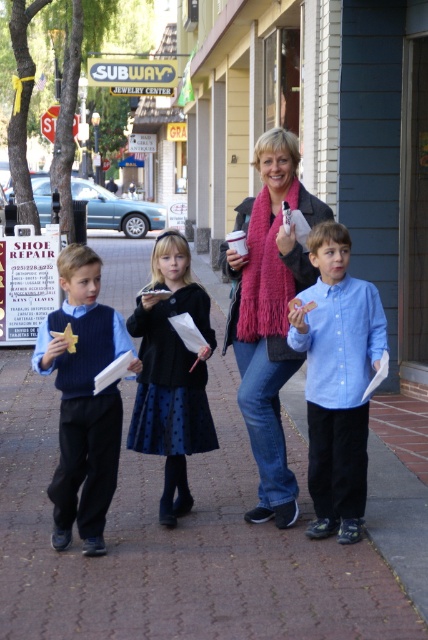
Who is shorter, blue button-down shirt at center or black wool sweater at center?

With less height is black wool sweater at center.

Which is more to the left, blue button-down shirt at center or black wool sweater at center?

Positioned to the left is black wool sweater at center.

Which is behind, point (368, 376) or point (174, 260)?

Positioned behind is point (174, 260).

Locate an element on the screen. This screenshot has width=428, height=640. blue button-down shirt at center is located at coordinates (336, 380).

At what (x,y) coordinates should I click in order to perform the action: click on brown brick pavement at center. Please return your answer as a coordinate pair (x, y). The width and height of the screenshot is (428, 640). Looking at the image, I should click on coord(177,540).

Is point (223, 492) more distant than point (276, 522)?

That is True.

Who is more distant from viewer, (146, 493) or (241, 225)?

Point (146, 493)

Where is `brown brick pavement at center`? Image resolution: width=428 pixels, height=640 pixels. brown brick pavement at center is located at coordinates (177, 540).

Measure the distance from brown brick pavement at center to black wool sweater at center.

The distance of brown brick pavement at center from black wool sweater at center is 4.29 feet.

Does point (27, 374) lie in front of point (171, 484)?

No, (27, 374) is further to viewer.

Is point (166, 538) positioned in front of point (172, 326)?

Yes, point (166, 538) is in front of point (172, 326).

I want to click on brown brick pavement at center, so click(x=177, y=540).